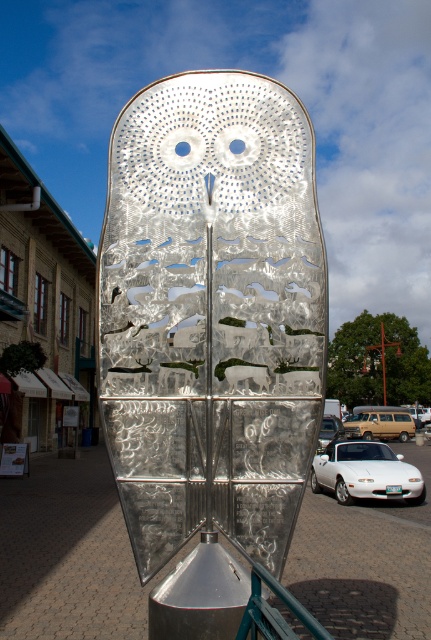
You are a delivery driver who needs to park your truck between the two white glossy cars. The truck is 6 meters long. Is there enough space between the white glossy car at lower center and the white glossy car at center to park the truck?

The distance between the white glossy car at lower center and the white glossy car at center is 5.49 meters. Since the truck is 6 meters long, there is not enough space to park the truck between them.

You are a photographer trying to capture both the white glossy car at lower center and the gold metallic van at center in a single shot. Based on their positions, which vehicle should you focus on first to ensure both are in frame?

The white glossy car at lower center is above the gold metallic van at center, so you should focus on the gold metallic van at center first to ensure both are within the frame.